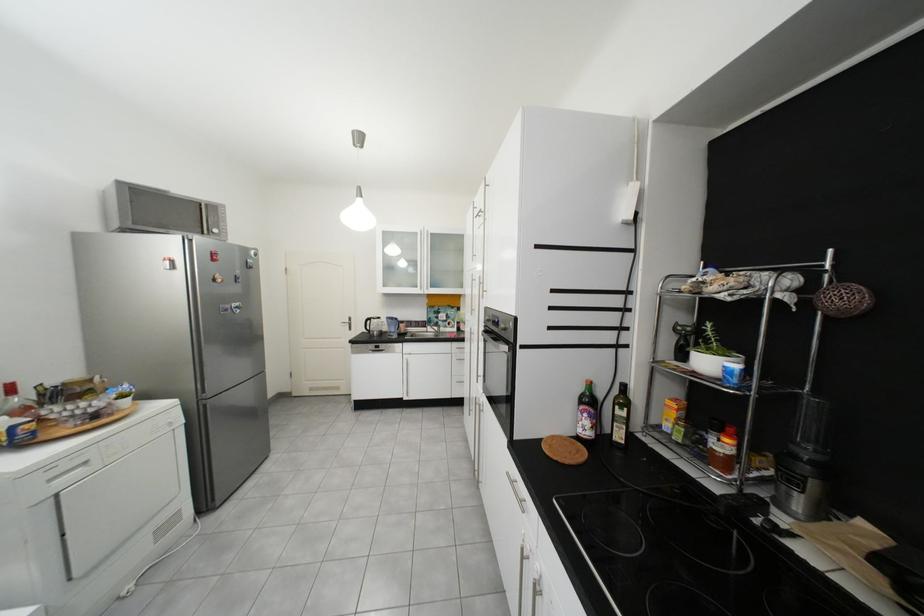
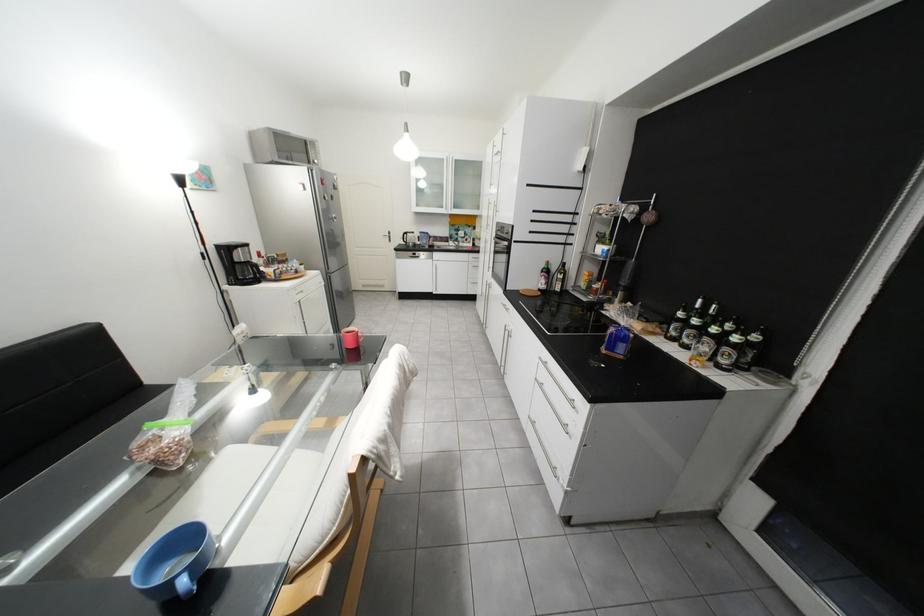
In the second image, find the point that corresponds to pixel 187 403 in the first image.

(330, 273)